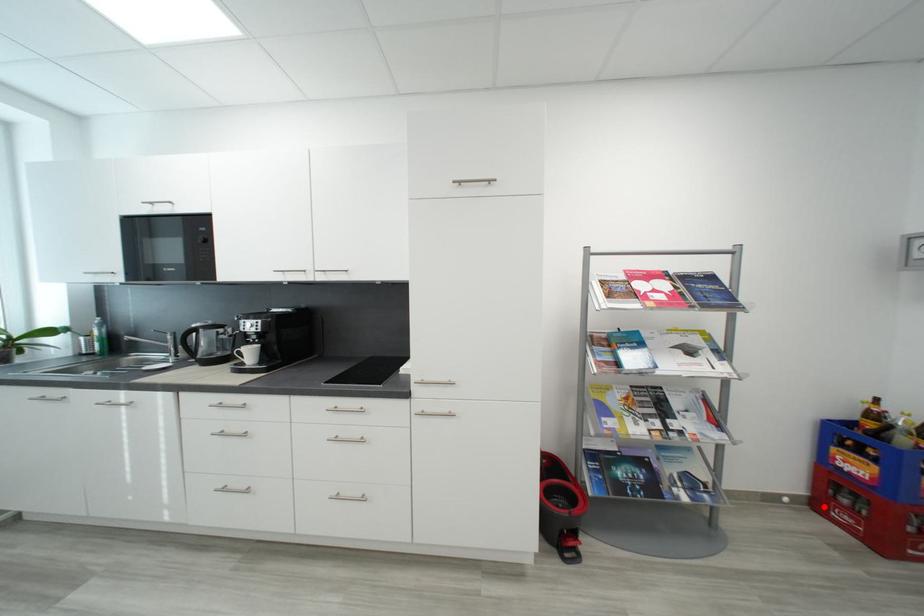
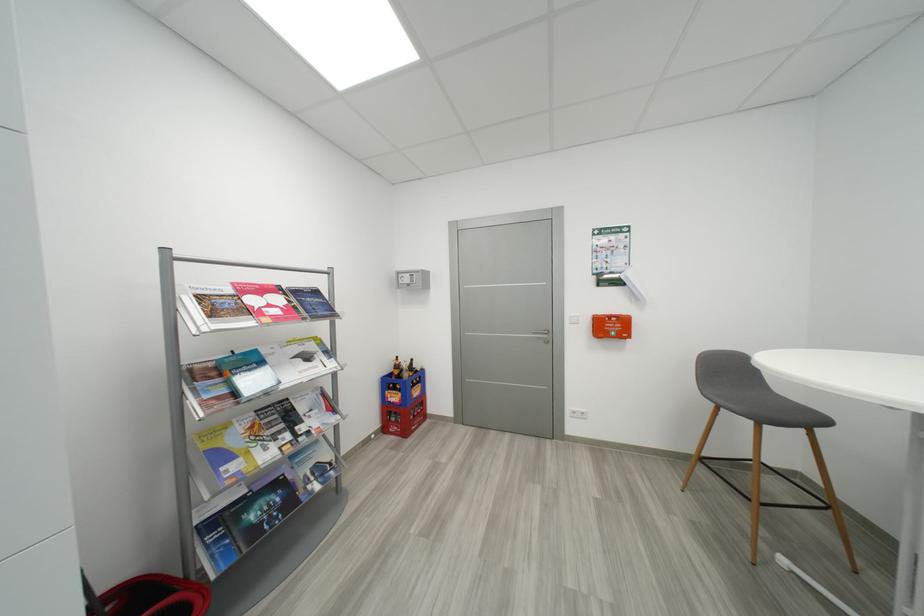
In the second image, find the point that corresponds to the highlighted location in the first image.

(392, 431)